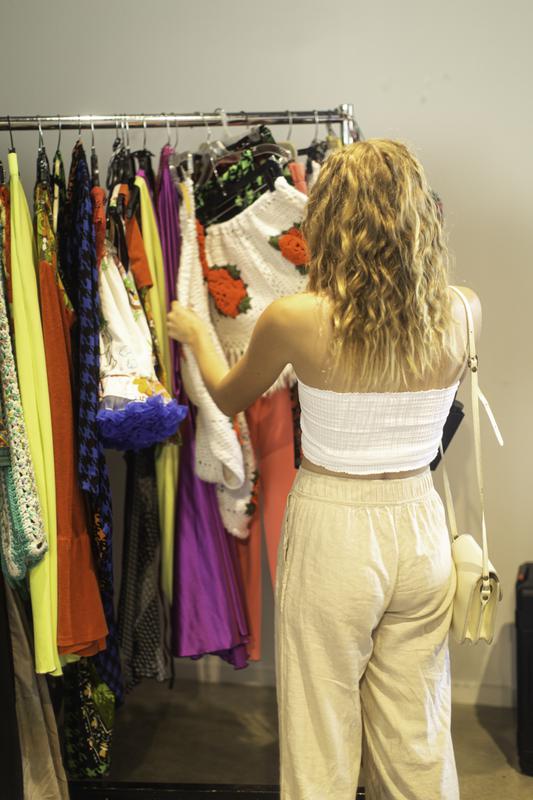
Identify the location of baseboard. (488, 701).